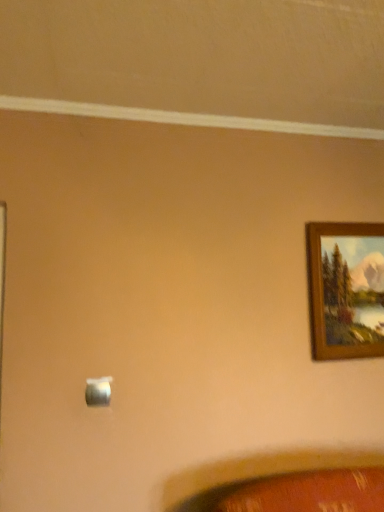
Question: Is satin silver switch at lower center smaller than wooden picture frame at upper right?

Choices:
 (A) no
 (B) yes

Answer: (B)

Question: Is satin silver switch at lower center positioned far away from wooden picture frame at upper right?

Choices:
 (A) no
 (B) yes

Answer: (B)

Question: From a real-world perspective, is satin silver switch at lower center beneath wooden picture frame at upper right?

Choices:
 (A) no
 (B) yes

Answer: (B)

Question: Is satin silver switch at lower center looking in the opposite direction of wooden picture frame at upper right?

Choices:
 (A) yes
 (B) no

Answer: (B)

Question: Considering the relative positions of satin silver switch at lower center and wooden picture frame at upper right in the image provided, is satin silver switch at lower center in front of wooden picture frame at upper right?

Choices:
 (A) no
 (B) yes

Answer: (B)

Question: Is satin silver switch at lower center next to wooden picture frame at upper right?

Choices:
 (A) yes
 (B) no

Answer: (B)

Question: From the image's perspective, is wooden picture frame at upper right above satin silver switch at lower center?

Choices:
 (A) yes
 (B) no

Answer: (A)

Question: Is wooden picture frame at upper right further to camera compared to satin silver switch at lower center?

Choices:
 (A) no
 (B) yes

Answer: (B)

Question: Is the position of wooden picture frame at upper right less distant than that of satin silver switch at lower center?

Choices:
 (A) yes
 (B) no

Answer: (B)

Question: Is satin silver switch at lower center surrounded by wooden picture frame at upper right?

Choices:
 (A) no
 (B) yes

Answer: (A)

Question: Considering the relative sizes of wooden picture frame at upper right and satin silver switch at lower center in the image provided, is wooden picture frame at upper right shorter than satin silver switch at lower center?

Choices:
 (A) no
 (B) yes

Answer: (A)

Question: Can you confirm if wooden picture frame at upper right is wider than satin silver switch at lower center?

Choices:
 (A) no
 (B) yes

Answer: (B)

Question: Considering the positions of point (350, 264) and point (97, 377), is point (350, 264) closer or farther from the camera than point (97, 377)?

Choices:
 (A) farther
 (B) closer

Answer: (A)